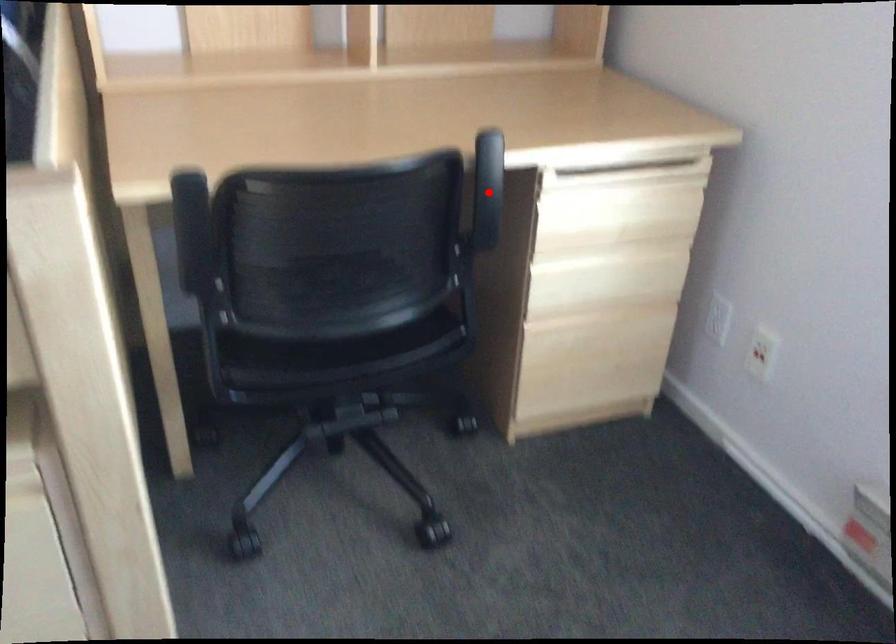
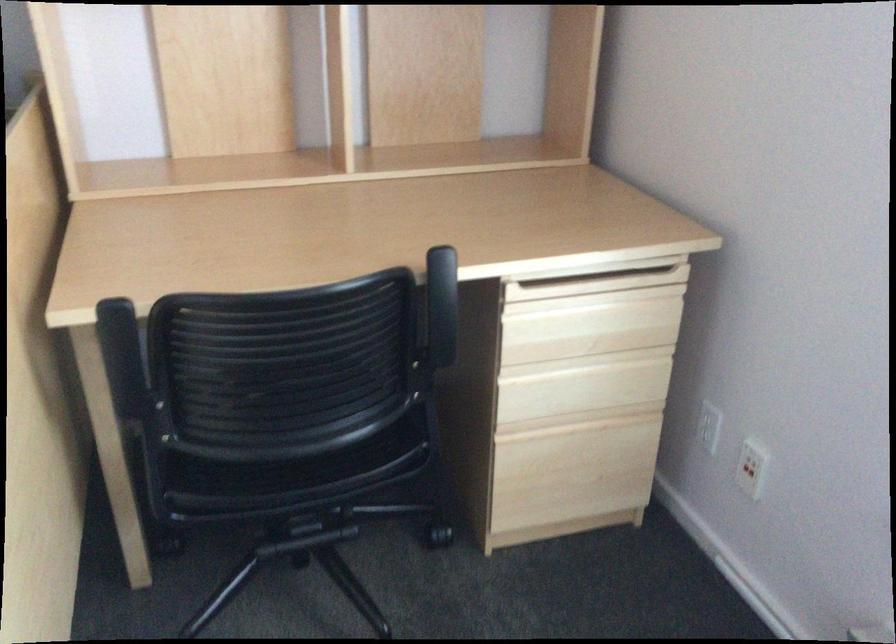
In the second image, find the point that corresponds to the highlighted location in the first image.

(441, 306)